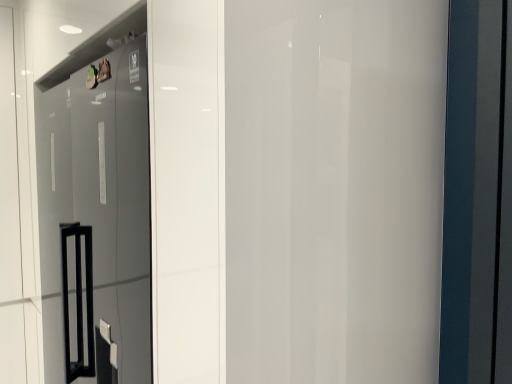
Where is `glossy metallic elevator door at left`? The width and height of the screenshot is (512, 384). glossy metallic elevator door at left is located at coordinates (334, 189).

Describe the element at coordinates (334, 189) in the screenshot. I see `glossy metallic elevator door at left` at that location.

Identify the location of glossy metallic elevator door at left. This screenshot has width=512, height=384. (334, 189).